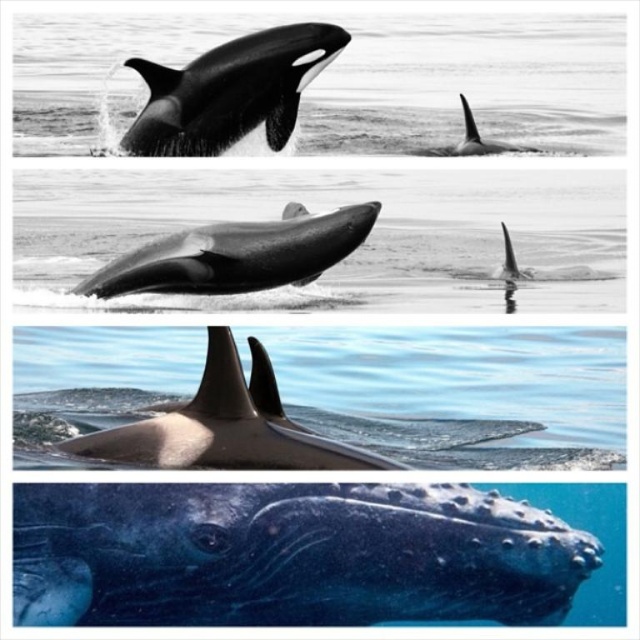
Based on the coordinates provided, which object corresponds to the point (230, 92) in the top panel?

The point (230, 92) corresponds to the black smooth orca at upper left.

You are a marine biologist observing the image. You notice the black smooth orca at upper left and the smooth gray dolphin at center. Which of these two marine mammals is closer to you in the image?

The black smooth orca at upper left is closer to you because it is positioned further to the viewer than the smooth gray dolphin at center.